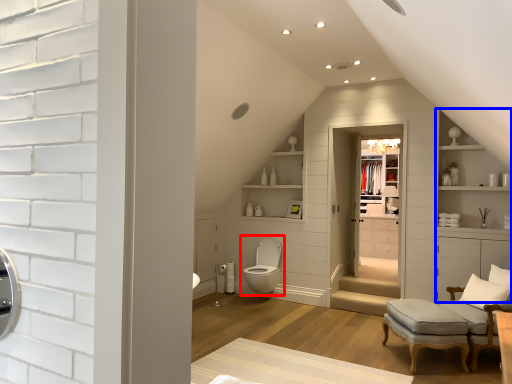
Question: Which object appears closest to the camera in this image, toilet (highlighted by a red box) or dresser (highlighted by a blue box)?

Choices:
 (A) toilet
 (B) dresser

Answer: (B)